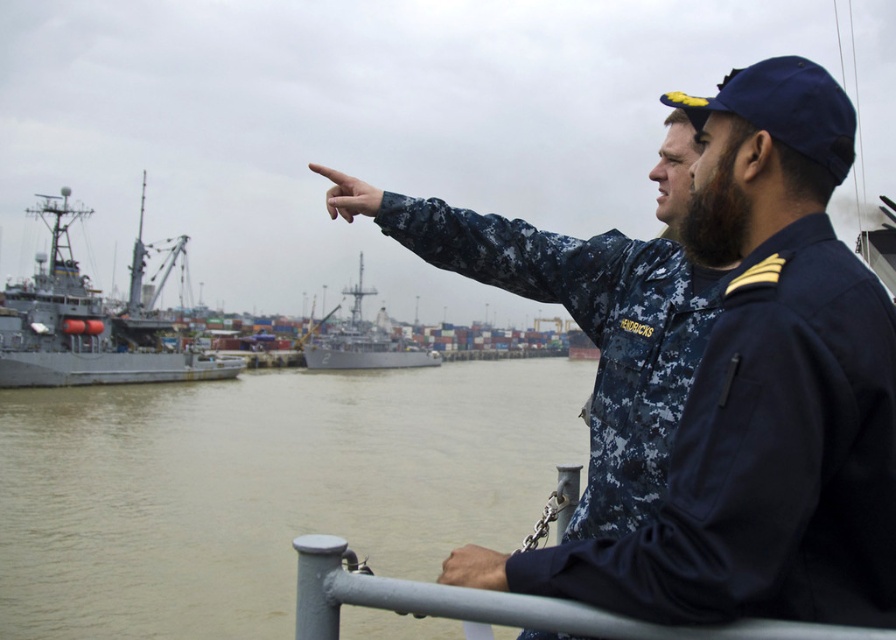
You are a sailor standing on the dock and see the brown murky water at center and the skinny tan hand at center. Which object is wider?

The brown murky water at center is wider than the skinny tan hand at center.

You are a new recruit at the naval dockyard. Your commanding officer has instructed you to locate two specific items in the scene. The first is the digital camouflage uniform at center, and the second is the gray metallic ship at center. According to the scene description, which object is positioned to the right of the other?

The digital camouflage uniform at center is to the right of the gray metallic ship at center.